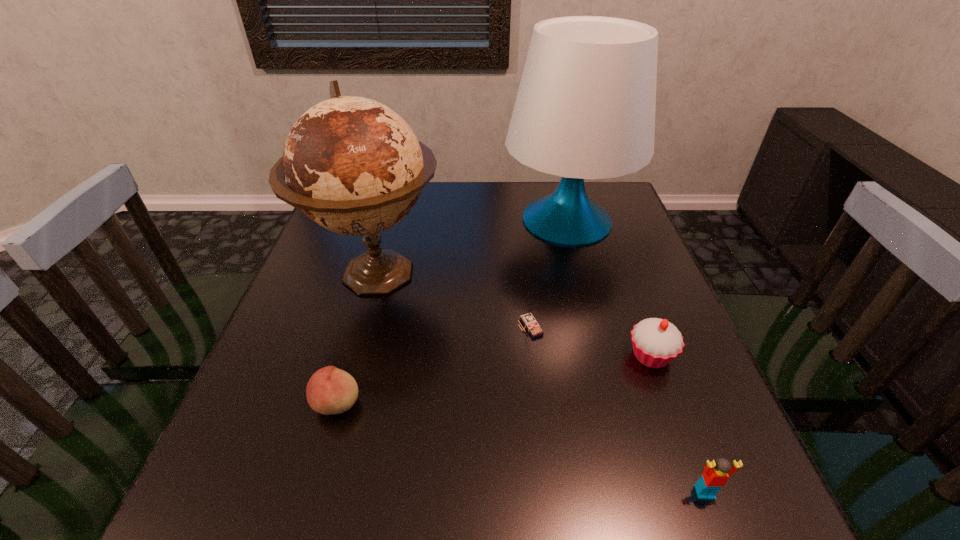
You are a GUI agent. You are given a task and a screenshot of the screen. Output one action in this format:
    pyautogui.click(x=<x>, y=<y>)
    Task: Click on the free space between the matchbox and the peach
    This screenshot has width=960, height=540.
    Given the screenshot: What is the action you would take?
    pyautogui.click(x=434, y=364)

Identify the location of object that is the closest to the matchbox. The height and width of the screenshot is (540, 960). (656, 342).

Select which object is the fourth closest to the globe. Please provide its 2D coordinates. Your answer should be formatted as a tuple, i.e. [(x, y)], where the tuple contains the x and y coordinates of a point satisfying the conditions above.

[(656, 342)]

You are a GUI agent. You are given a task and a screenshot of the screen. Output one action in this format:
    pyautogui.click(x=<x>, y=<y>)
    Task: Click on the vacant region that satisfies the following two spatial constraints: 1. on the front-facing side of the table lamp; 2. on the front side of the peach
    This screenshot has height=540, width=960.
    Given the screenshot: What is the action you would take?
    pyautogui.click(x=614, y=402)

This screenshot has height=540, width=960. What are the coordinates of `vacant region that satisfies the following two spatial constraints: 1. on the front-facing side of the table lamp; 2. on the front side of the matchbox` in the screenshot? It's located at (594, 327).

I want to click on free space that satisfies the following two spatial constraints: 1. on the front of the globe showing Asia; 2. on the left side of the cupcake, so click(353, 356).